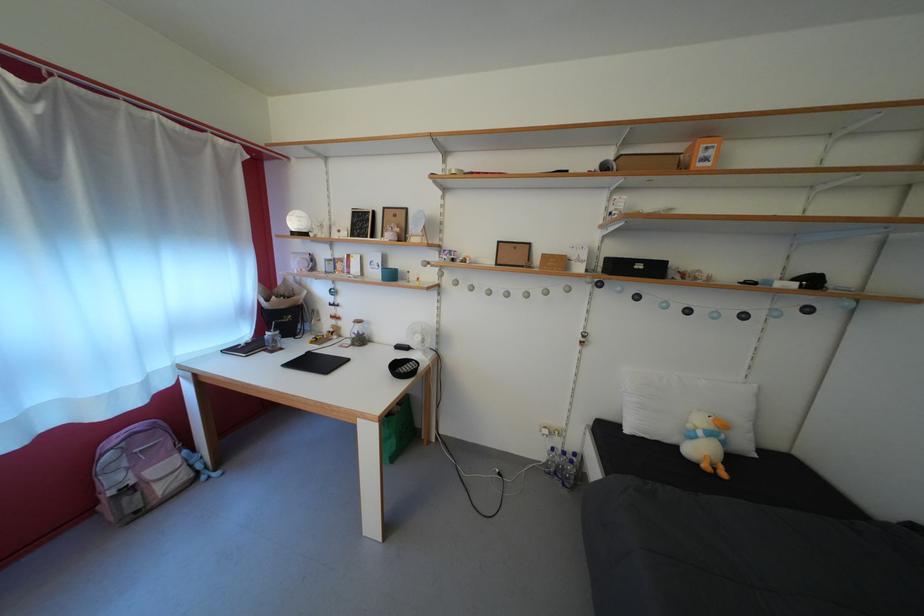
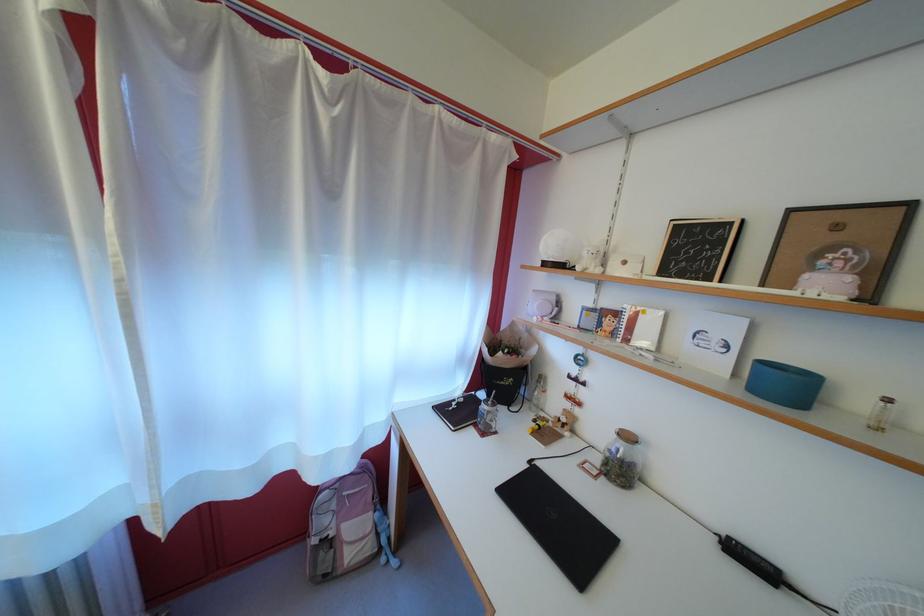
Where in the second image is the point corresponding to (x=274, y=357) from the first image?

(483, 431)